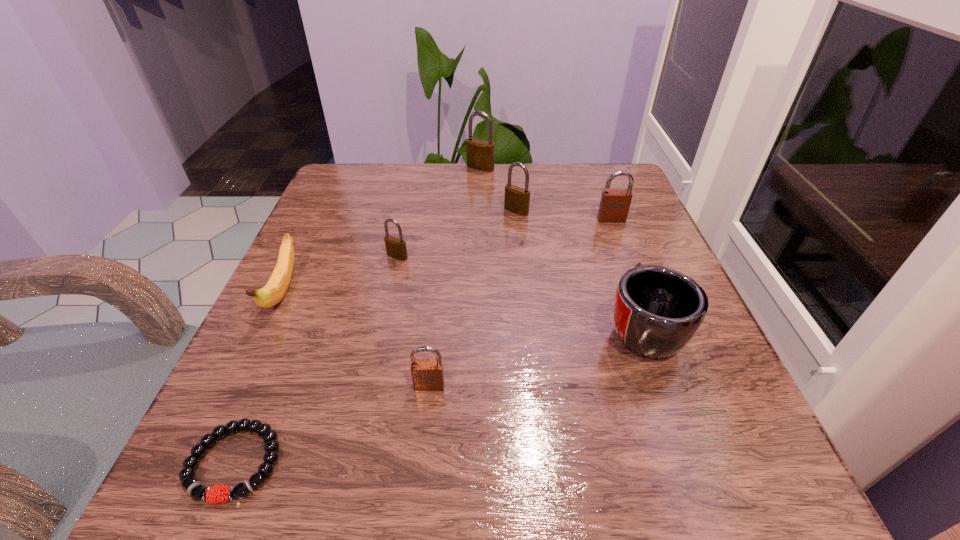
Locate which brass padlock ranks in proximity to the red mug. Please provide its 2D coordinates. Your answer should be formatted as a tuple, i.e. [(x, y)], where the tuple contains the x and y coordinates of a point satisfying the conditions above.

[(517, 199)]

Locate which brass padlock is the closest to the banana. Please provide its 2D coordinates. Your answer should be formatted as a tuple, i.e. [(x, y)], where the tuple contains the x and y coordinates of a point satisfying the conditions above.

[(396, 248)]

Locate an element on the screen. The height and width of the screenshot is (540, 960). free space that satisfies the following two spatial constraints: 1. on the back side of the nearest brass padlock; 2. on the right side of the farthest brass padlock is located at coordinates (417, 167).